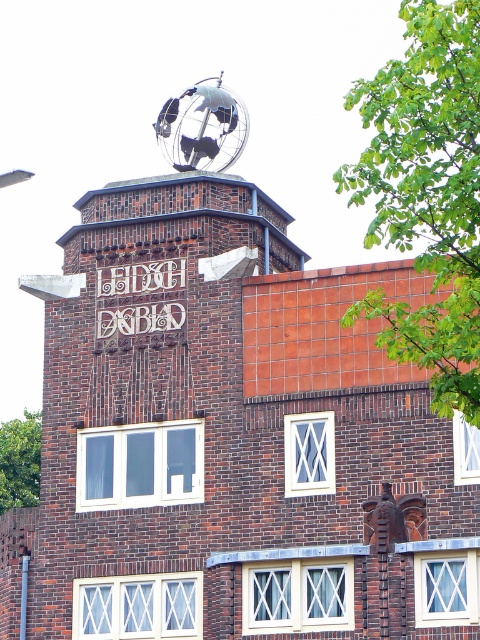
You are an architect examining the building. There is a point marked at coordinates (203, 125). What object is located at this point?

The point at coordinates (203, 125) corresponds to the metallic globe at top.

You are standing in front of the brick building and notice the metallic globe at top. Can you determine its position relative to the inscription LEIDSE DAGBLAD?

The metallic globe at top is located at point (203,125), which is above the inscription LEIDSE DAGBLAD.

You are an architect examining the brick building. You notice the metallic globe at top and the white ceramic sign at center. Which object would cast a longer shadow during midday? Please explain your reasoning.

The metallic globe at top is much taller than the white ceramic sign at center. Since taller objects typically cast longer shadows when the sun is at its highest point, the metallic globe at top would cast a longer shadow during midday.